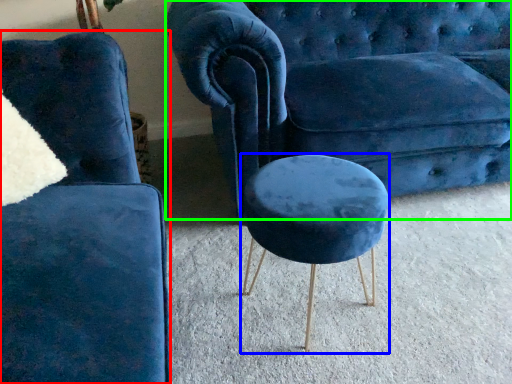
Question: Considering the real-world distances, which object is farthest from chair (highlighted by a red box)? stool (highlighted by a blue box) or studio couch (highlighted by a green box)?

Choices:
 (A) stool
 (B) studio couch

Answer: (B)